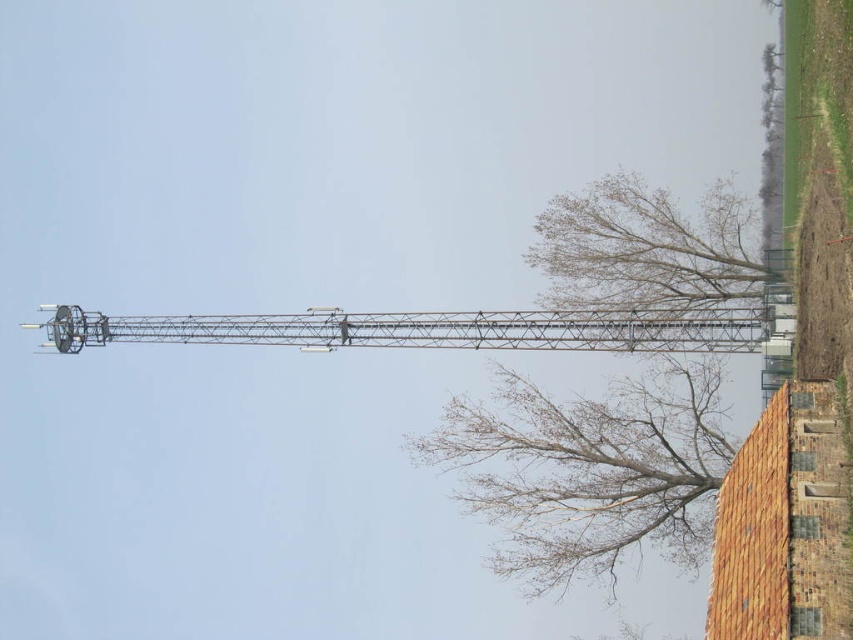
Can you confirm if bare branches at lower right is positioned to the right of bare branches at upper right?

In fact, bare branches at lower right is to the left of bare branches at upper right.

Who is positioned more to the right, bare branches at lower right or bare branches at upper right?

From the viewer's perspective, bare branches at upper right appears more on the right side.

Describe the element at coordinates (589, 468) in the screenshot. The image size is (853, 640). I see `bare branches at lower right` at that location.

Where is `bare branches at lower right`? Image resolution: width=853 pixels, height=640 pixels. bare branches at lower right is located at coordinates (589, 468).

Between bare branches at lower right and metallic lift at center, which one appears on the left side from the viewer's perspective?

Result: Positioned to the left is metallic lift at center.

Which is below, bare branches at lower right or metallic lift at center?

bare branches at lower right is below.

Who is more distant from viewer, (x=511, y=468) or (x=306, y=344)?

Positioned behind is point (x=306, y=344).

Where is `bare branches at lower right`? Image resolution: width=853 pixels, height=640 pixels. bare branches at lower right is located at coordinates (589, 468).

Looking at this image, which of these two, bare branches at upper right or metallic lift at center, stands shorter?

metallic lift at center is shorter.

What do you see at coordinates (653, 250) in the screenshot?
I see `bare branches at upper right` at bounding box center [653, 250].

Find the location of a particular element. The image size is (853, 640). bare branches at upper right is located at coordinates (653, 250).